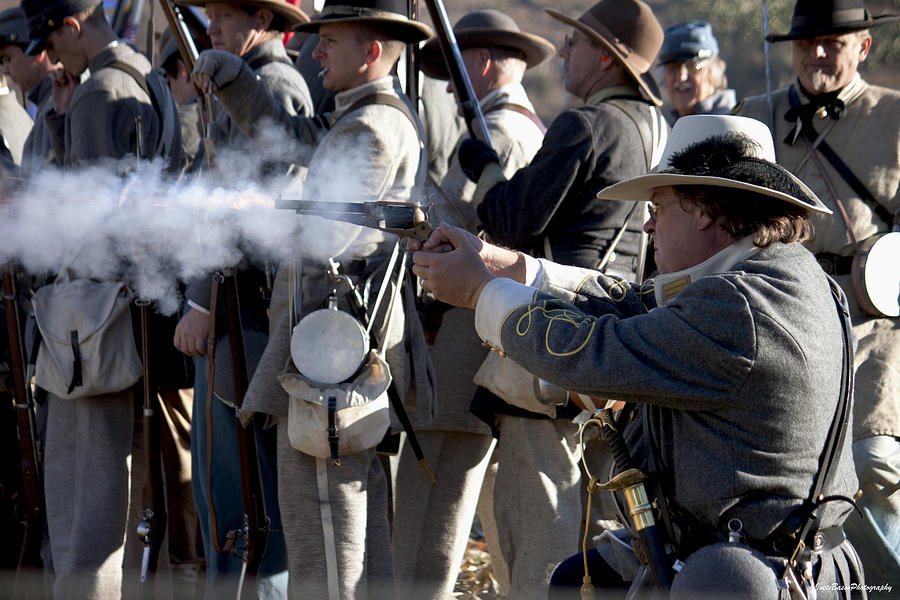
You are a GUI agent. You are given a task and a screenshot of the screen. Output one action in this format:
    pyautogui.click(x=<x>, y=<y>)
    Task: Click on the canteen
    Image resolution: width=900 pixels, height=600 pixels.
    Given the screenshot: What is the action you would take?
    pyautogui.click(x=321, y=345)